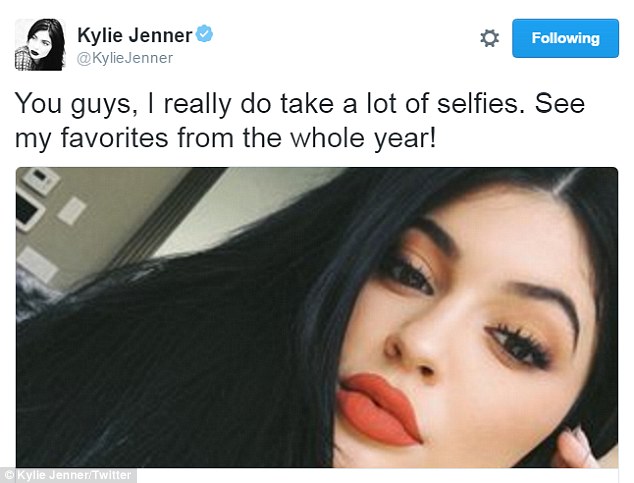
Where is `screen`? The height and width of the screenshot is (483, 634). screen is located at coordinates (23, 207).